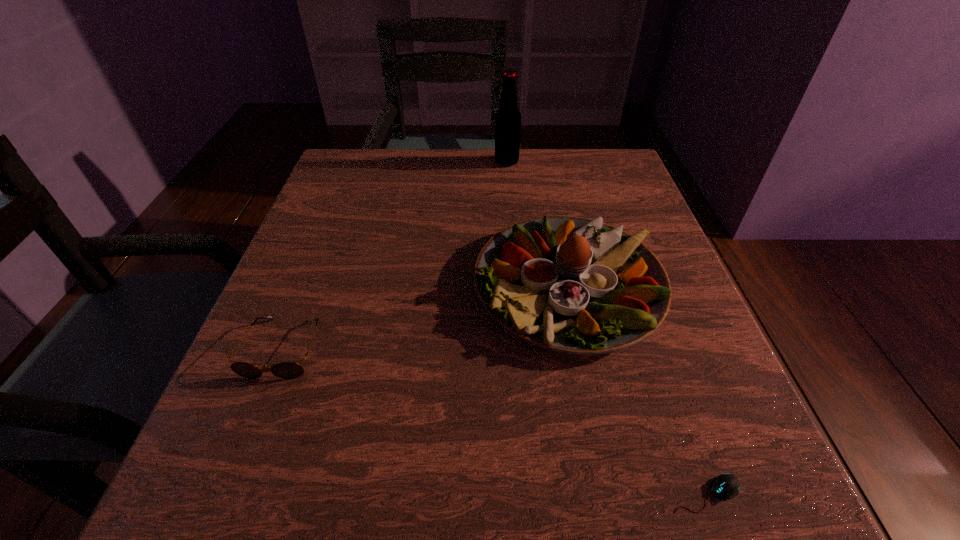
Image resolution: width=960 pixels, height=540 pixels. I want to click on the farthest object, so click(508, 117).

Locate an element on the screen. The width and height of the screenshot is (960, 540). the tallest object is located at coordinates (508, 117).

The height and width of the screenshot is (540, 960). Find the location of `salad plate`. salad plate is located at coordinates (569, 284).

This screenshot has height=540, width=960. I want to click on the second shortest object, so click(287, 370).

Locate an element on the screen. the leftmost object is located at coordinates (287, 370).

This screenshot has height=540, width=960. In order to click on the shortest object in this screenshot , I will do `click(724, 486)`.

At what (x,y) coordinates should I click in order to perform the action: click on the nearest object. Please return your answer as a coordinate pair (x, y). Looking at the image, I should click on (724, 486).

Identify the location of blank space located on the right of the beer bottle. (626, 162).

The height and width of the screenshot is (540, 960). I want to click on free space located on the left of the salad plate, so click(x=386, y=286).

The width and height of the screenshot is (960, 540). What are the coordinates of `vacant area situated 0.160m on the lenses of the sunglasses` in the screenshot? It's located at (226, 494).